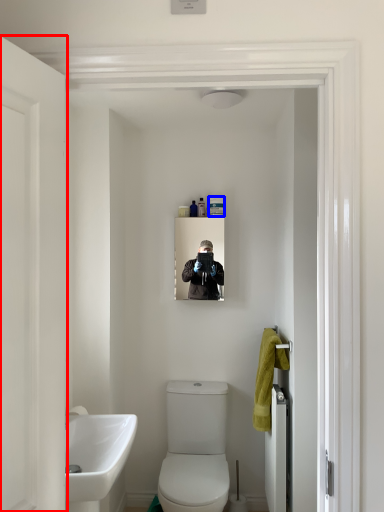
Question: Which point is closer to the camera, door (highlighted by a red box) or toiletry (highlighted by a blue box)?

Choices:
 (A) door
 (B) toiletry

Answer: (A)